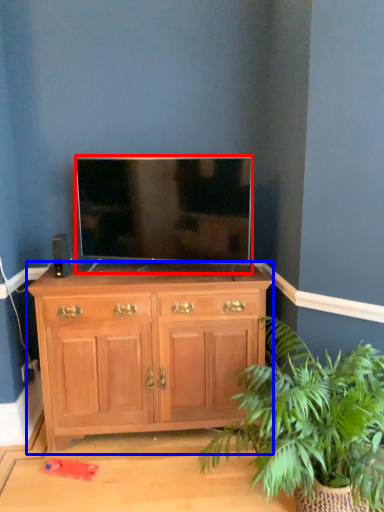
Question: Which object is closer to the camera taking this photo, television (highlighted by a red box) or chest of drawers (highlighted by a blue box)?

Choices:
 (A) television
 (B) chest of drawers

Answer: (A)